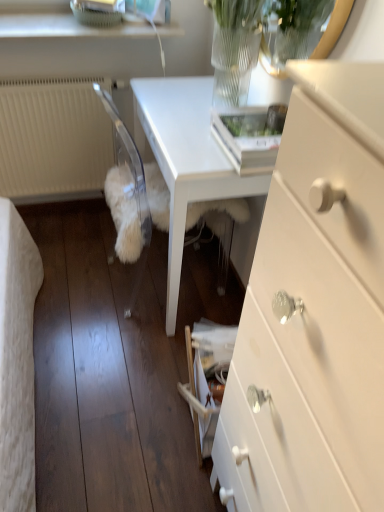
Locate an element on the screen. This screenshot has width=384, height=512. vacant region to the left of white fluffy dog at lower center is located at coordinates (79, 273).